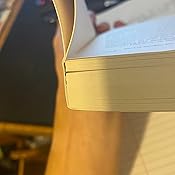
Where is `chalkboard`? Image resolution: width=175 pixels, height=175 pixels. chalkboard is located at coordinates (31, 98).